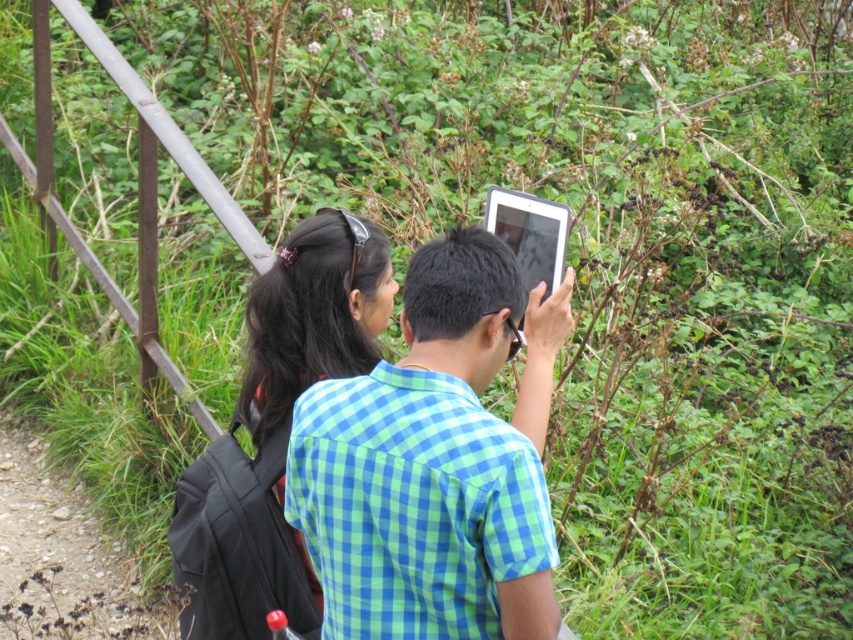
Is green checkered shirt at center bigger than silver metallic tablet at center?

Yes, green checkered shirt at center is bigger than silver metallic tablet at center.

Between point (349, 387) and point (496, 195), which one is positioned behind?

The point (496, 195) is behind.

Is point (405, 339) positioned before point (527, 198)?

Yes, point (405, 339) is closer to viewer.

The width and height of the screenshot is (853, 640). I want to click on green checkered shirt at center, so click(x=436, y=461).

Consider the image. Which is more to the right, green checkered shirt at center or black hair at upper center?

green checkered shirt at center

Between green checkered shirt at center and black hair at upper center, which one has more height?

black hair at upper center is taller.

Who is more forward, (316, 499) or (352, 298)?

Point (316, 499)

Where is `green checkered shirt at center`? green checkered shirt at center is located at coordinates (436, 461).

Can you confirm if black hair at upper center is wider than silver metallic tablet at center?

Yes, black hair at upper center is wider than silver metallic tablet at center.

Identify the location of black hair at upper center. This screenshot has height=640, width=853. (314, 316).